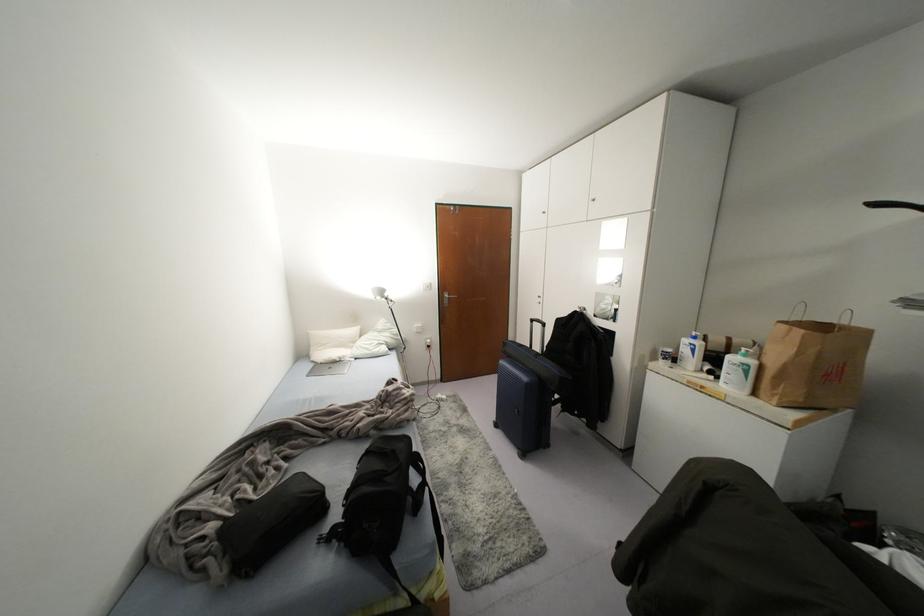
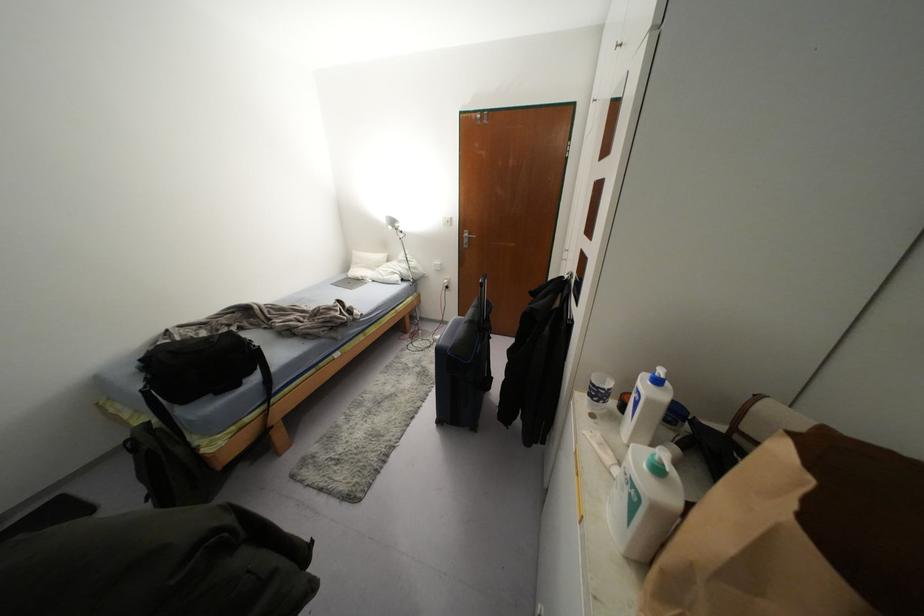
Where in the second image is the point corresponding to (445,296) from the first image?

(465, 233)